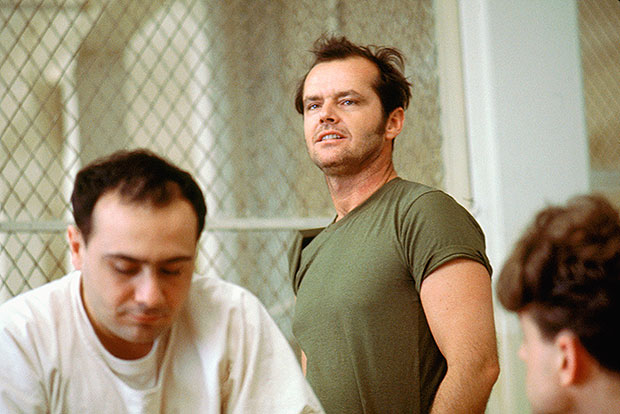
This screenshot has height=414, width=620. Identify the location of white facing of wall behind jack. (516, 122).